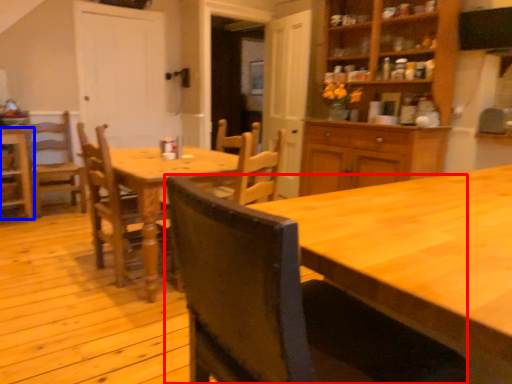
Question: Which object is further to the camera taking this photo, chair (highlighted by a red box) or chair (highlighted by a blue box)?

Choices:
 (A) chair
 (B) chair

Answer: (B)